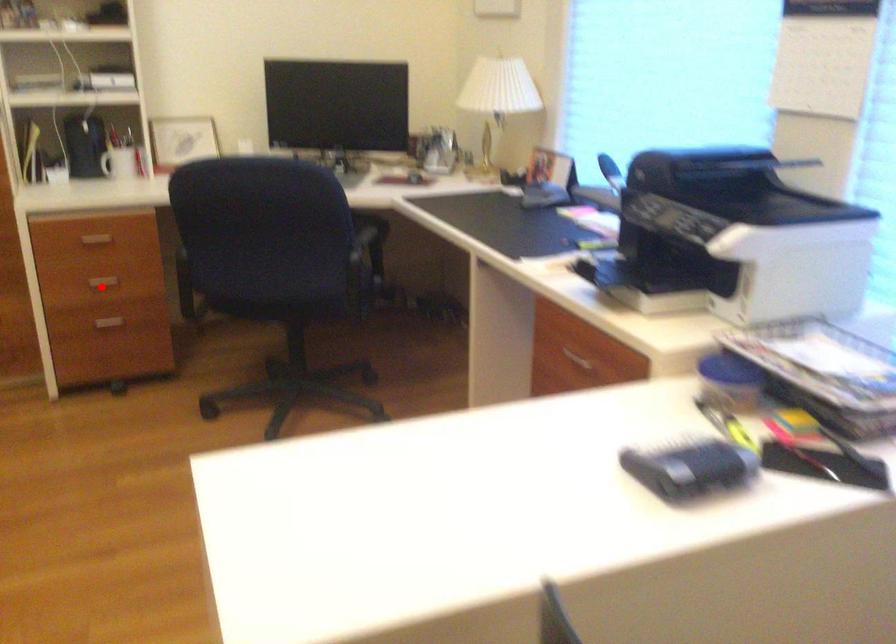
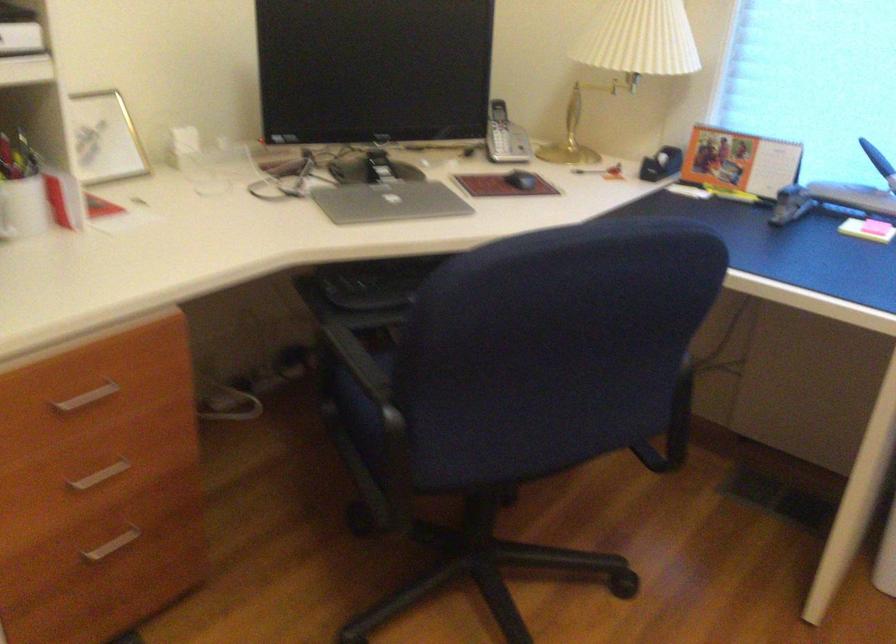
Question: I am providing you with two images of the same scene from different viewpoints. A red point is marked on the first image. Is the red point's position out of view in image 2?

Choices:
 (A) Yes
 (B) No

Answer: (B)